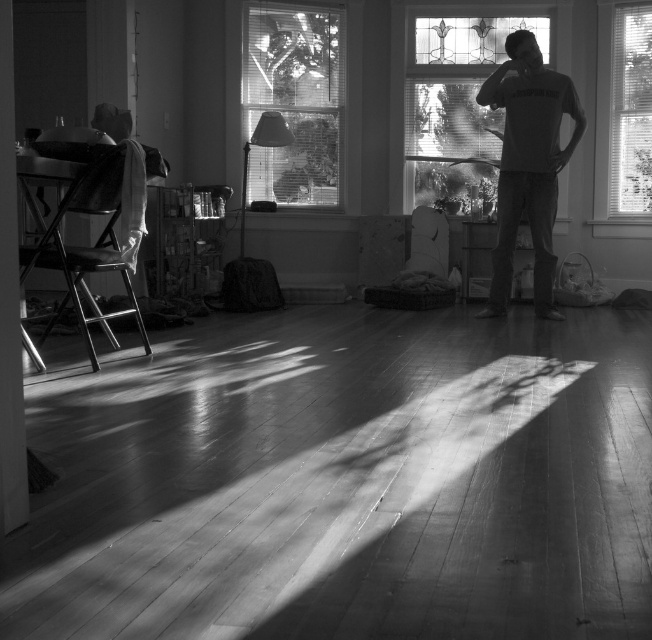
Question: Is clear glass window at upper center to the right of transparent glass window at right from the viewer's perspective?

Choices:
 (A) yes
 (B) no

Answer: (B)

Question: Considering the real-world distances, which object is closest to the clear glass window at center?

Choices:
 (A) transparent glass window at right
 (B) gray cotton shirt at center
 (C) clear glass window at upper center

Answer: (C)

Question: Among these points, which one is farthest from the camera?

Choices:
 (A) (649, 214)
 (B) (535, 96)

Answer: (A)

Question: Does clear glass window at upper center appear on the right side of gray cotton shirt at center?

Choices:
 (A) no
 (B) yes

Answer: (A)

Question: Which point is closer to the camera taking this photo?

Choices:
 (A) (261, 12)
 (B) (499, 259)
 (C) (632, 180)
 (D) (449, 177)

Answer: (B)

Question: Does clear glass window at center come behind clear glass window at upper center?

Choices:
 (A) no
 (B) yes

Answer: (B)